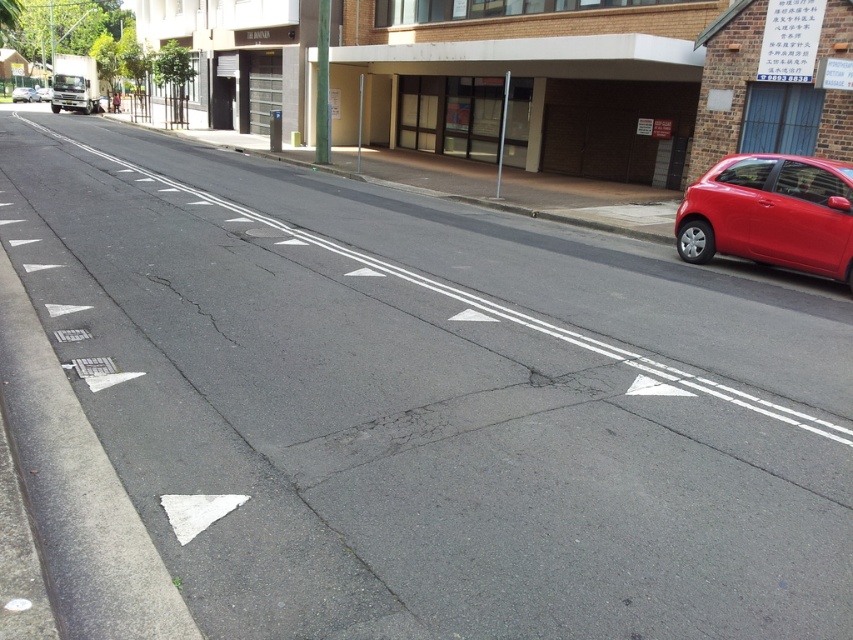
You are standing on the street and see two points marked on the road. The first point is at coordinates point (790,237) and the second is at point (49,99). Which point is closer to you?

Point (790,237) is closer to the viewer than point (49,99).

You are a delivery driver who needs to park your metallic silver car at center in a space that can only accommodate vehicles smaller than it. You see the red glossy hatchback at right already parked there. Can you park your car in the same spot?

The metallic silver car at center is larger in size than the red glossy hatchback at right, so it cannot fit into the parking space that accommodates the smaller vehicle.

You are a delivery driver who needs to park your truck between the shiny red hatchback at right and the red glossy hatchback at right. According to the scene description, which hatchback should you position your truck closer to in order to park properly?

You should position your truck closer to the shiny red hatchback at right because the shiny red hatchback at right is below the red glossy hatchback at right, so there is more space between them to park.